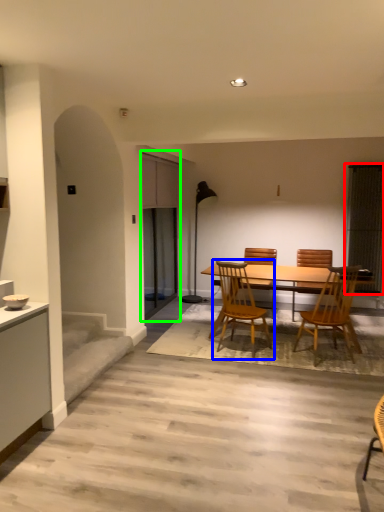
Question: Which object is the farthest from window screen (highlighted by a red box)? Choose among these: chair (highlighted by a blue box) or screen door (highlighted by a green box).

Choices:
 (A) chair
 (B) screen door

Answer: (B)